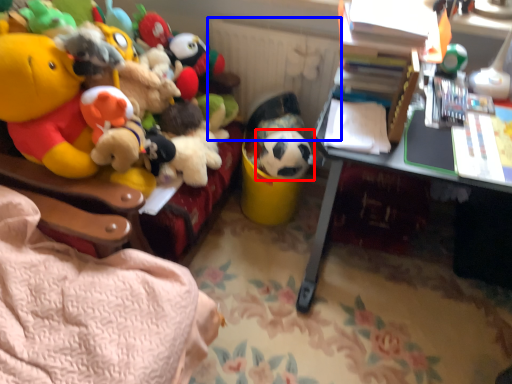
Question: Which object appears farthest to the camera in this image, toy (highlighted by a red box) or radiator (highlighted by a blue box)?

Choices:
 (A) toy
 (B) radiator

Answer: (B)